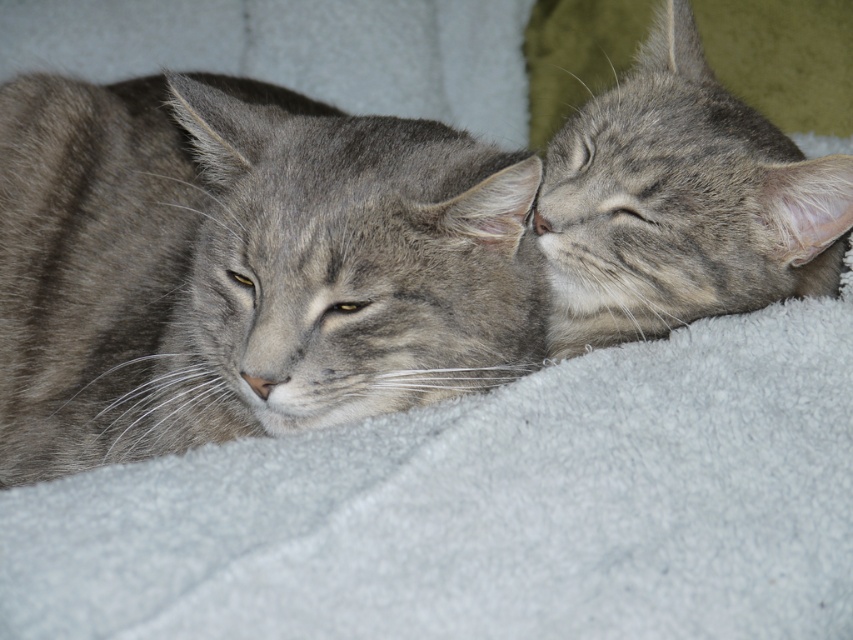
Question: Among these objects, which one is nearest to the camera?

Choices:
 (A) gray tabby cat at upper right
 (B) gray striped cat at left

Answer: (B)

Question: Is gray striped cat at left above gray tabby cat at upper right?

Choices:
 (A) no
 (B) yes

Answer: (A)

Question: Can you confirm if gray striped cat at left is smaller than gray tabby cat at upper right?

Choices:
 (A) no
 (B) yes

Answer: (A)

Question: Which point is farther to the camera?

Choices:
 (A) (634, 170)
 (B) (103, 173)

Answer: (B)

Question: Can you confirm if gray striped cat at left is smaller than gray tabby cat at upper right?

Choices:
 (A) no
 (B) yes

Answer: (A)